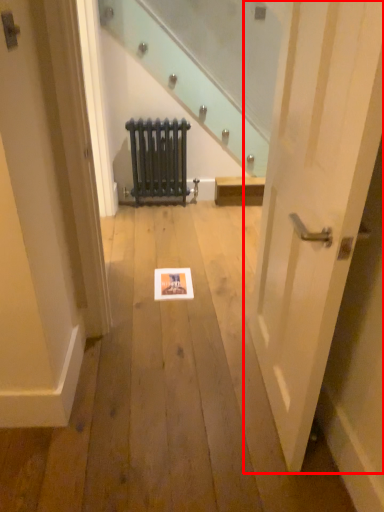
Question: From the image's perspective, considering the relative positions of door (annotated by the red box) and radiator in the image provided, where is door (annotated by the red box) located with respect to the staircase?

Choices:
 (A) below
 (B) above

Answer: (A)